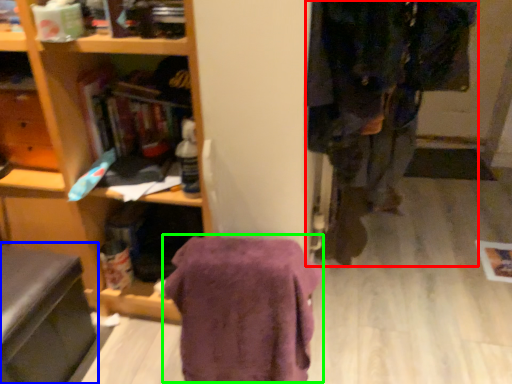
Question: Which is farther away from clothing (highlighted by a red box)? swivel chair (highlighted by a blue box) or blanket (highlighted by a green box)?

Choices:
 (A) swivel chair
 (B) blanket

Answer: (A)